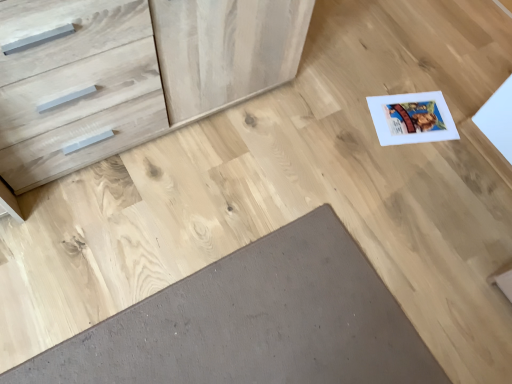
Question: Relative to natural wood chest of drawers at upper left, is brown matte doormat at lower center in front or behind?

Choices:
 (A) front
 (B) behind

Answer: (B)

Question: Considering the positions of brown matte doormat at lower center and natural wood chest of drawers at upper left in the image, is brown matte doormat at lower center bigger or smaller than natural wood chest of drawers at upper left?

Choices:
 (A) small
 (B) big

Answer: (A)

Question: Considering the positions of brown matte doormat at lower center and natural wood chest of drawers at upper left in the image, is brown matte doormat at lower center taller or shorter than natural wood chest of drawers at upper left?

Choices:
 (A) tall
 (B) short

Answer: (B)

Question: From their relative heights in the image, would you say natural wood chest of drawers at upper left is taller or shorter than brown matte doormat at lower center?

Choices:
 (A) short
 (B) tall

Answer: (B)

Question: Is natural wood chest of drawers at upper left to the left or to the right of brown matte doormat at lower center in the image?

Choices:
 (A) right
 (B) left

Answer: (B)

Question: Does point (93, 145) appear closer or farther from the camera than point (152, 380)?

Choices:
 (A) farther
 (B) closer

Answer: (A)

Question: From the image's perspective, relative to brown matte doormat at lower center, is natural wood chest of drawers at upper left above or below?

Choices:
 (A) below
 (B) above

Answer: (B)